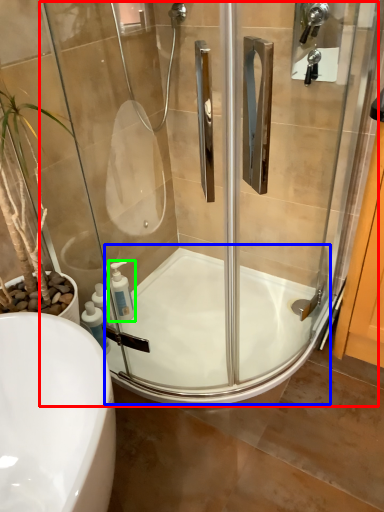
Question: Which object is the closest to the screen door (highlighted by a red box)? Choose among these: bath (highlighted by a blue box) or soap dispenser (highlighted by a green box).

Choices:
 (A) bath
 (B) soap dispenser

Answer: (A)